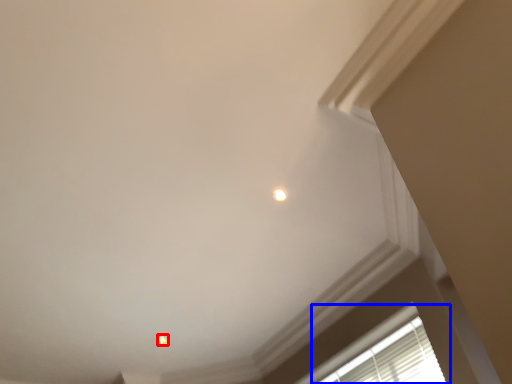
Question: Among these objects, which one is farthest to the camera, dot (highlighted by a red box) or window (highlighted by a blue box)?

Choices:
 (A) dot
 (B) window

Answer: (A)